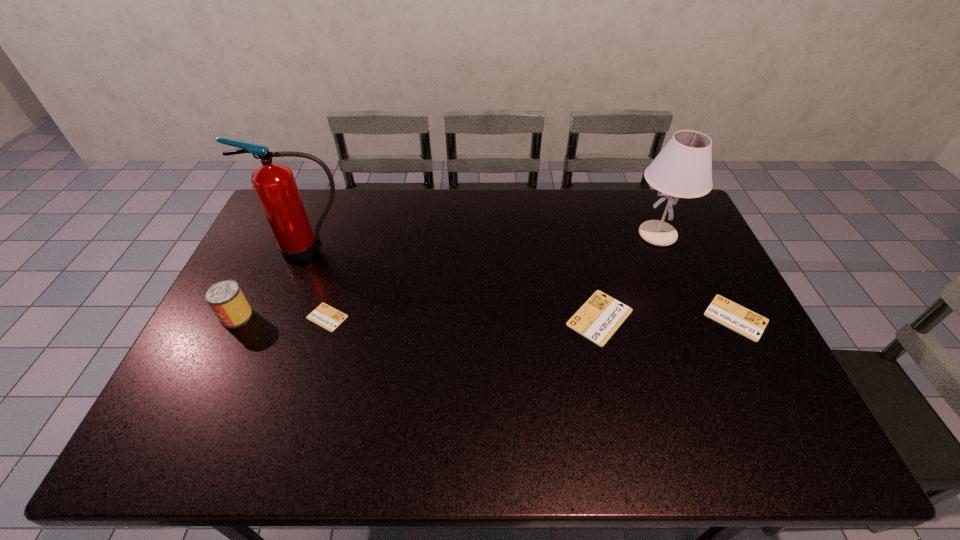
Locate an element on the screen. the shortest object is located at coordinates (324, 315).

The image size is (960, 540). Identify the location of the leftmost identity card. (324, 315).

Locate an element on the screen. the second identity card from left to right is located at coordinates (598, 319).

You are a GUI agent. You are given a task and a screenshot of the screen. Output one action in this format:
    pyautogui.click(x=<x>, y=<y>)
    Task: Click on the rightmost identity card
    The width and height of the screenshot is (960, 540).
    Given the screenshot: What is the action you would take?
    pyautogui.click(x=728, y=313)

Identify the location of the second tallest identity card. (728, 313).

The image size is (960, 540). I want to click on lampshade, so click(x=683, y=169).

The width and height of the screenshot is (960, 540). I want to click on fire extinguisher, so click(x=274, y=183).

You are a GUI agent. You are given a task and a screenshot of the screen. Output one action in this format:
    pyautogui.click(x=<x>, y=<y>)
    Task: Click on the third tallest object
    
    Given the screenshot: What is the action you would take?
    pyautogui.click(x=225, y=298)

Find the location of a particular element. The image size is (960, 540). vacant space located 0.260m on the right of the shortest object is located at coordinates (438, 317).

This screenshot has width=960, height=540. Identify the location of vacant space located 0.080m on the front of the fourth object from left to right. (612, 373).